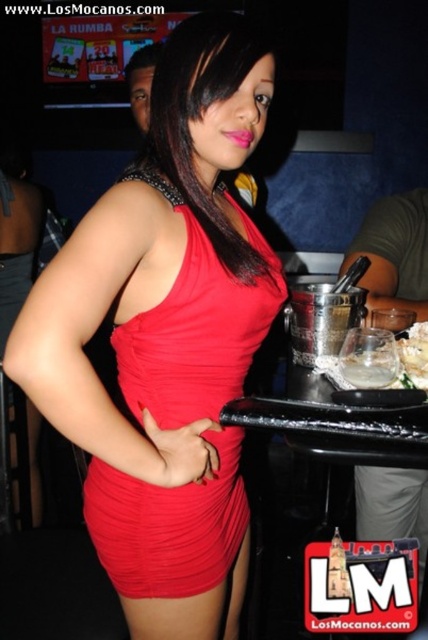
You are a photographer adjusting your camera to focus on two points in the nightclub scene. The first point is at coordinates point [392,376], and the second point is at coordinates point [404,344]. Which point should you focus on first if you want to capture the closest object in the scene?

Point [392,376] is closer to the camera than point [404,344], so you should focus on point [392,376] first to capture the closest object in the scene.

You are a waiter in a busy nightclub. You need to deliver a drink to the customer at the bar. The clear glass at lower right and the white crumbly cake at center are on the bar. How far apart are these two items?

The clear glass at lower right is 3.89 inches away from the white crumbly cake at center.

You are a photographer at the nightclub and need to capture a photo that includes both the shiny satin dress at center and the clear glass at lower right. Since the clear glass might be hard to see, which object should you focus on to ensure both are visible?

The shiny satin dress at center has a greater height compared to the clear glass at lower right, so focusing on the shiny satin dress at center would ensure both are visible as the dress is taller and more prominent.